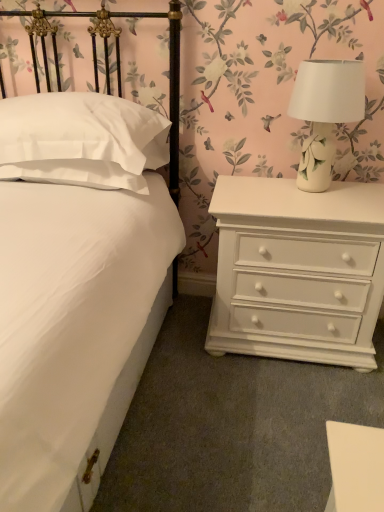
Question: Does white matte bed at center have a greater width compared to white satin pillow at left?

Choices:
 (A) yes
 (B) no

Answer: (A)

Question: Does white matte bed at center have a greater height compared to white satin pillow at left?

Choices:
 (A) yes
 (B) no

Answer: (A)

Question: From a real-world perspective, is white matte bed at center located higher than white satin pillow at left?

Choices:
 (A) no
 (B) yes

Answer: (A)

Question: Does white matte bed at center have a larger size compared to white satin pillow at left?

Choices:
 (A) no
 (B) yes

Answer: (B)

Question: From the image's perspective, would you say white matte bed at center is shown under white satin pillow at left?

Choices:
 (A) no
 (B) yes

Answer: (B)

Question: Considering the relative sizes of white matte bed at center and white satin pillow at left in the image provided, is white matte bed at center shorter than white satin pillow at left?

Choices:
 (A) yes
 (B) no

Answer: (B)

Question: From a real-world perspective, is white painted wood chest of drawers at right located higher than white satin pillow at left?

Choices:
 (A) yes
 (B) no

Answer: (B)

Question: Is white painted wood chest of drawers at right positioned behind white satin pillow at left?

Choices:
 (A) no
 (B) yes

Answer: (B)

Question: Is white painted wood chest of drawers at right closer to camera compared to white satin pillow at left?

Choices:
 (A) no
 (B) yes

Answer: (A)

Question: Is white painted wood chest of drawers at right taller than white satin pillow at left?

Choices:
 (A) no
 (B) yes

Answer: (B)

Question: Is there a large distance between white painted wood chest of drawers at right and white satin pillow at left?

Choices:
 (A) no
 (B) yes

Answer: (A)

Question: From the image's perspective, is white painted wood chest of drawers at right beneath white satin pillow at left?

Choices:
 (A) yes
 (B) no

Answer: (A)

Question: Is white matte bed at center wider than white ceramic lamp at upper right?

Choices:
 (A) no
 (B) yes

Answer: (B)